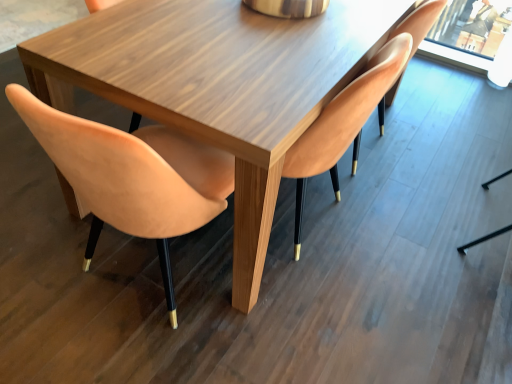
The width and height of the screenshot is (512, 384). What are the coordinates of `free space in front of matte orange chair at upper right, the 3th chair in the left-to-right sequence` in the screenshot? It's located at (393, 207).